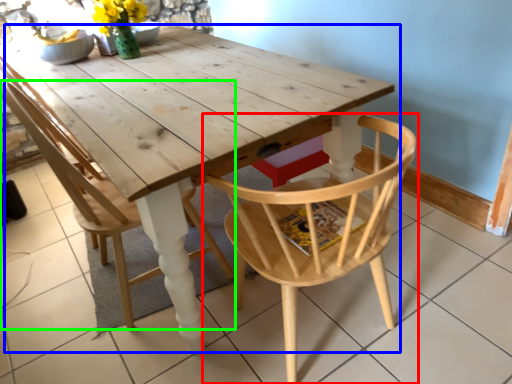
Question: Based on their relative distances, which object is farther from chair (highlighted by a red box)? Choose from table (highlighted by a blue box) and chair (highlighted by a green box).

Choices:
 (A) table
 (B) chair

Answer: (B)